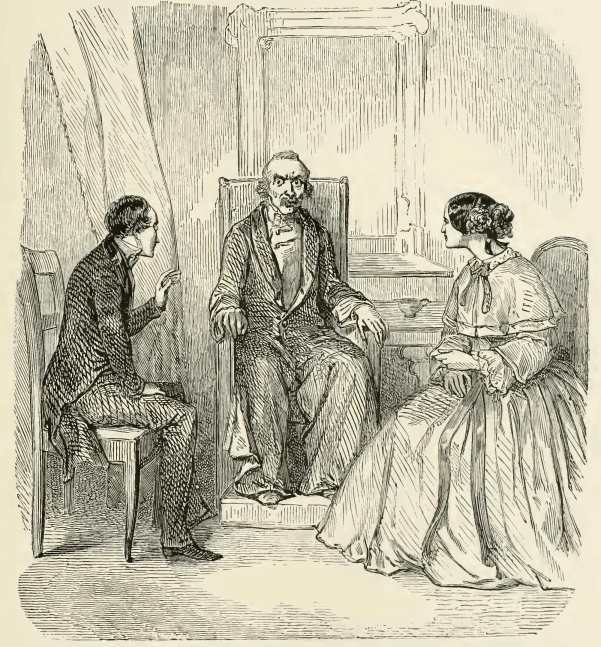
The height and width of the screenshot is (647, 601). In order to click on legs of the chair on the left in this screenshot , I will do `click(32, 485)`, `click(66, 485)`, `click(133, 497)`.